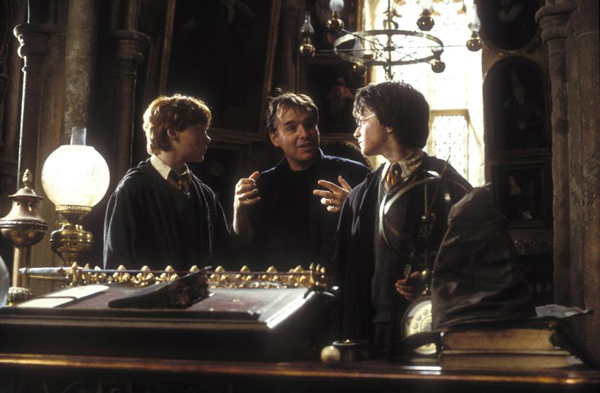
You are a GUI agent. You are given a task and a screenshot of the screen. Output one action in this format:
    pyautogui.click(x=<x>, y=<y>)
    Task: Click on the chandelier
    This screenshot has height=393, width=600.
    Given the screenshot: What is the action you would take?
    pyautogui.click(x=403, y=37)